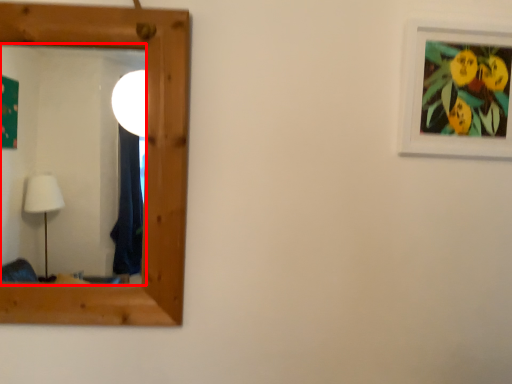
Question: From the image's perspective, what is the correct spatial positioning of mirror (annotated by the red box) in reference to picture frame?

Choices:
 (A) below
 (B) above

Answer: (A)